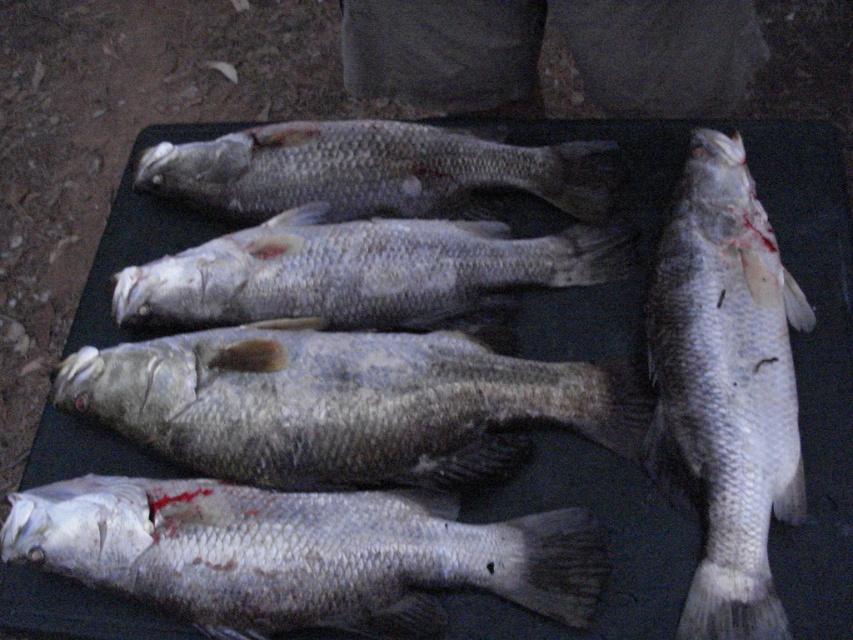
You are a chef preparing a meal and need to select the taller fish between the grayish silver fish at center and the slick silver fish at bottom. Which fish should you choose?

The grayish silver fish at center is taller than the slick silver fish at bottom, so you should choose the grayish silver fish at center.